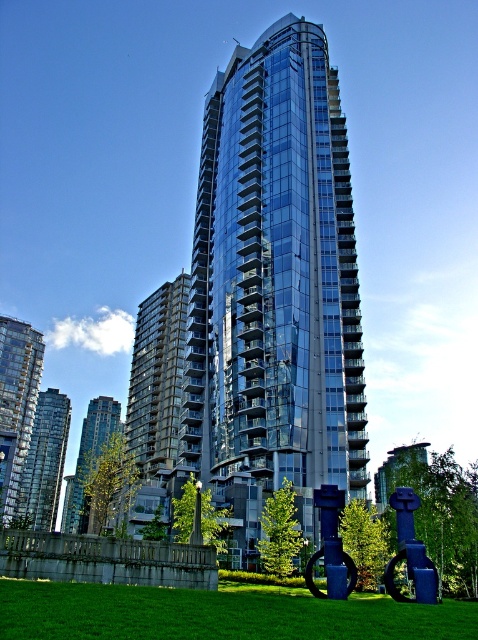
Question: Is matte glass building at left above glassy reflective building at left?

Choices:
 (A) yes
 (B) no

Answer: (A)

Question: Among these objects, which one is farthest from the camera?

Choices:
 (A) matte glass building at left
 (B) glassy reflective building at center

Answer: (B)

Question: Does green grass at lower center come in front of matte glass building at left?

Choices:
 (A) no
 (B) yes

Answer: (B)

Question: Which point is farther from the camera taking this photo?

Choices:
 (A) (360, 628)
 (B) (45, 525)
 (C) (196, 259)

Answer: (B)

Question: Which object appears farthest from the camera in this image?

Choices:
 (A) green grass at lower center
 (B) glassy reflective building at center
 (C) glassy reflective building at left

Answer: (B)

Question: Does transparent glass building at center lie behind glassy reflective building at center?

Choices:
 (A) yes
 (B) no

Answer: (B)